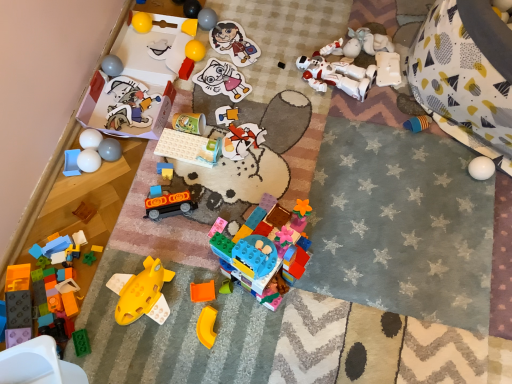
Locate an element on the screen. The image size is (512, 384). free point in front of matte gray ball at upper left, acting as the 7th toy starting from the left is located at coordinates (103, 203).